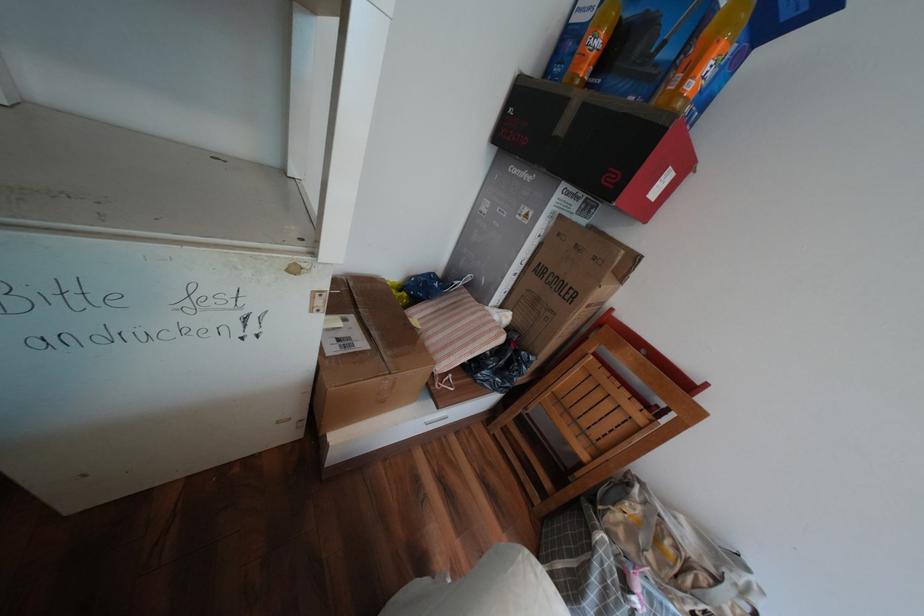
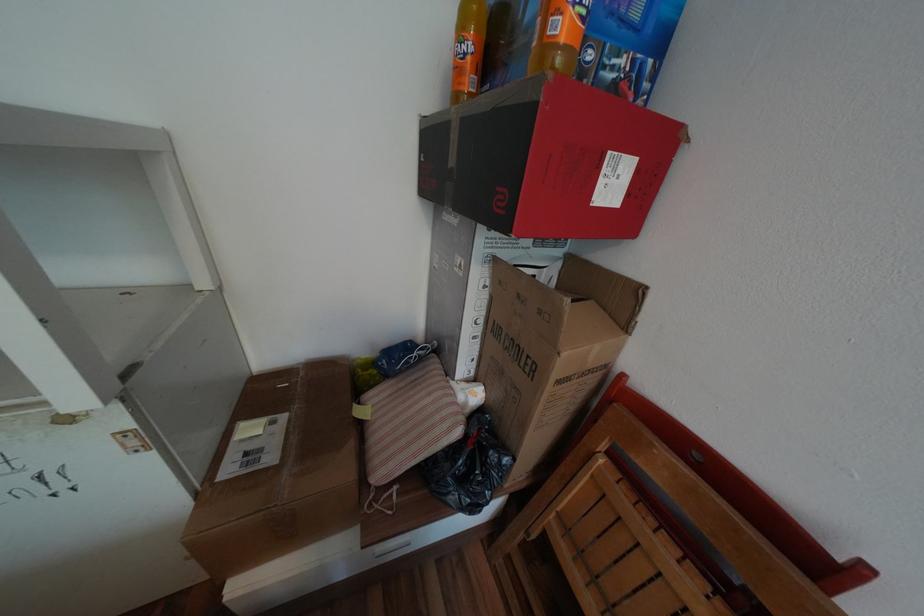
Where in the second image is the point corresponding to (x=609, y=26) from the first image?

(472, 31)